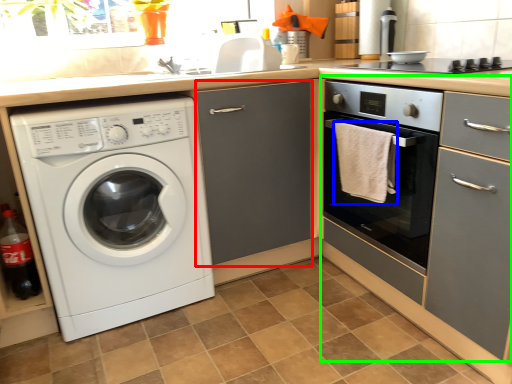
Question: Which is nearer to the screen door (highlighted by a red box)? bath towel (highlighted by a blue box) or cabinetry (highlighted by a green box).

Choices:
 (A) bath towel
 (B) cabinetry

Answer: (A)